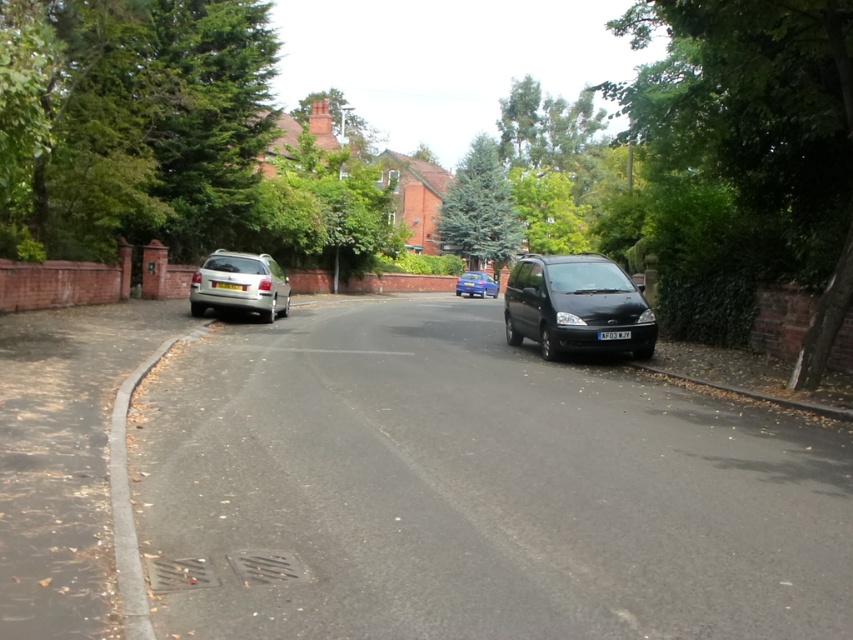
Is gray concrete driveway at lower left bigger than black matte van at center?

Correct, gray concrete driveway at lower left is larger in size than black matte van at center.

Is point (80, 321) closer to camera compared to point (567, 349)?

No, (80, 321) is behind (567, 349).

Which is in front, point (74, 576) or point (619, 308)?

Point (74, 576) is more forward.

In order to click on gray concrete driveway at lower left in this screenshot , I will do `click(64, 460)`.

You are a GUI agent. You are given a task and a screenshot of the screen. Output one action in this format:
    pyautogui.click(x=<x>, y=<y>)
    Task: Click on the black matte van at center
    The image size is (853, 640).
    Given the screenshot: What is the action you would take?
    pyautogui.click(x=576, y=305)

Between black matte van at center and yellow plastic license plate at center, which one appears on the left side from the viewer's perspective?

yellow plastic license plate at center

Identify the location of black matte van at center. Image resolution: width=853 pixels, height=640 pixels. (576, 305).

You are a GUI agent. You are given a task and a screenshot of the screen. Output one action in this format:
    pyautogui.click(x=<x>, y=<y>)
    Task: Click on the black matte van at center
    Image resolution: width=853 pixels, height=640 pixels.
    Given the screenshot: What is the action you would take?
    pyautogui.click(x=576, y=305)

Is black plastic license plate at center wider than yellow plastic license plate at center?

Incorrect, black plastic license plate at center's width does not surpass yellow plastic license plate at center's.

Is black plastic license plate at center below yellow plastic license plate at center?

Yes, black plastic license plate at center is below yellow plastic license plate at center.

This screenshot has width=853, height=640. In order to click on black plastic license plate at center in this screenshot , I will do `click(613, 333)`.

Where is `black plastic license plate at center`? The height and width of the screenshot is (640, 853). black plastic license plate at center is located at coordinates (613, 333).